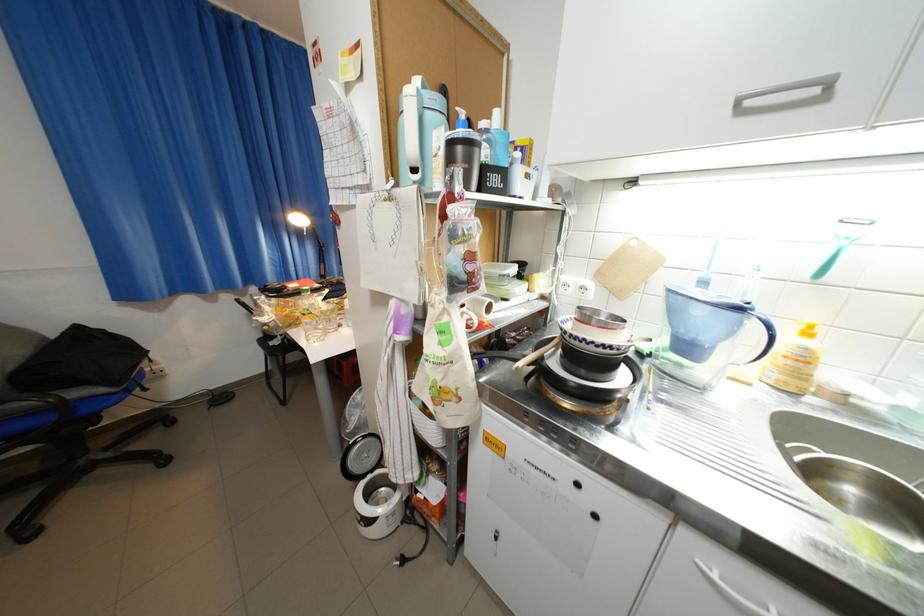
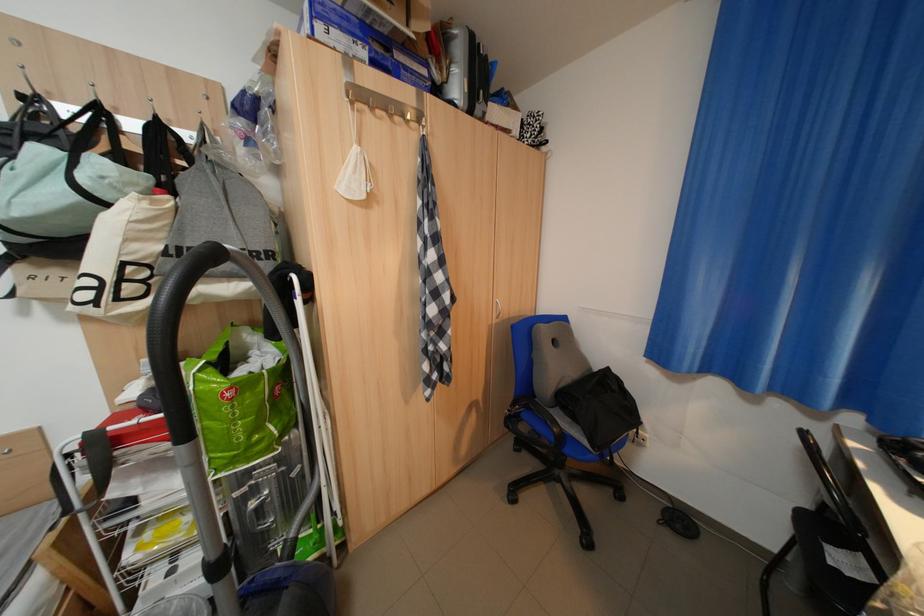
Question: The camera is either moving clockwise (left) or counter-clockwise (right) around the object. The first image is from the beginning of the video and the second image is from the end. Is the camera moving left or right when shooting the video?

Choices:
 (A) Left
 (B) Right

Answer: (B)